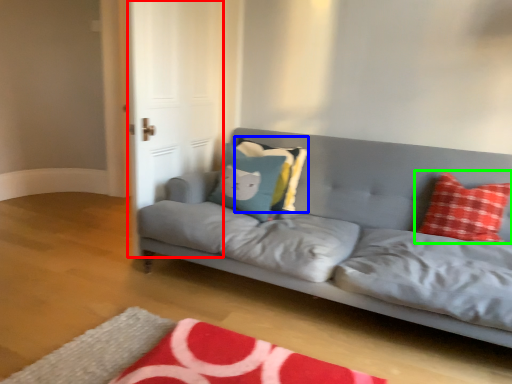
Question: Estimate the real-world distances between objects in this image. Which object is farther from glass door (highlighted by a red box), pillow (highlighted by a blue box) or pillow (highlighted by a green box)?

Choices:
 (A) pillow
 (B) pillow

Answer: (B)